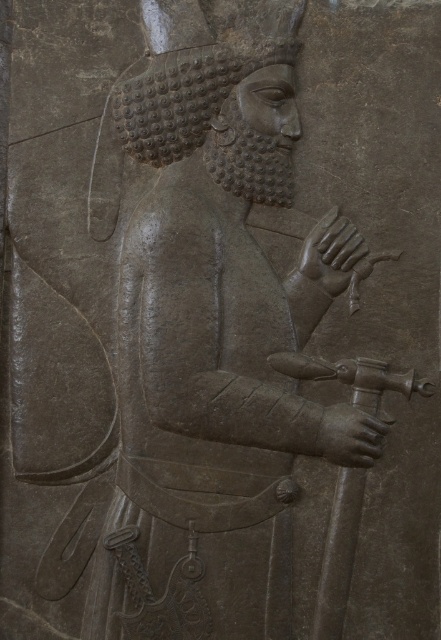
Question: Is gray stone figure at center positioned at the back of polished bronze hand at center?

Choices:
 (A) no
 (B) yes

Answer: (A)

Question: Can you confirm if smooth gray stone hand at center is bigger than polished bronze hand at center?

Choices:
 (A) no
 (B) yes

Answer: (B)

Question: Among these points, which one is farthest from the camera?

Choices:
 (A) (324, 220)
 (B) (337, 422)

Answer: (A)

Question: Does gray stone figure at center have a lesser width compared to polished bronze hand at center?

Choices:
 (A) no
 (B) yes

Answer: (A)

Question: Among these objects, which one is farthest from the camera?

Choices:
 (A) smooth gray stone hand at center
 (B) gray stone figure at center

Answer: (A)

Question: Which object is closer to the camera taking this photo?

Choices:
 (A) smooth gray stone hand at center
 (B) polished bronze hand at center
 (C) gray stone figure at center

Answer: (C)